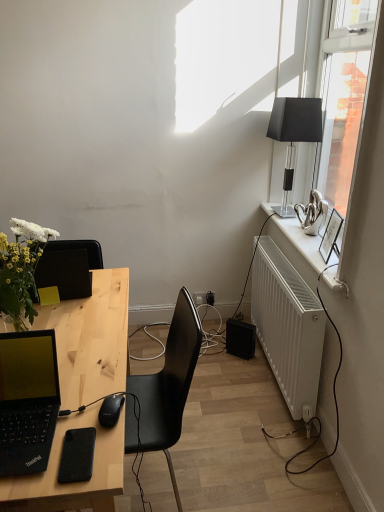
This screenshot has width=384, height=512. Identify the location of empty space that is in between black matte phone at lower left and black matte laptop at left. (69, 428).